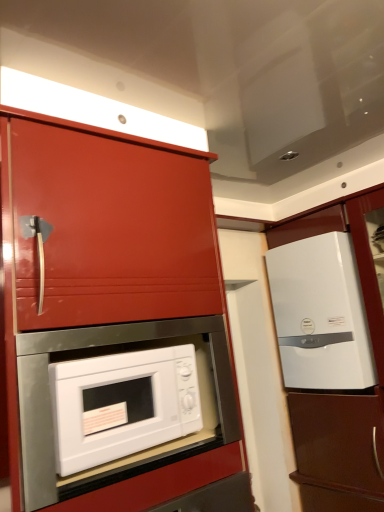
What do you see at coordinates (320, 314) in the screenshot?
I see `white glossy refrigerator at right` at bounding box center [320, 314].

What do you see at coordinates (115, 320) in the screenshot? I see `glossy red cabinet at center, the first cabinetry positioned from the left` at bounding box center [115, 320].

Where is `white glossy refrigerator at right`? The height and width of the screenshot is (512, 384). white glossy refrigerator at right is located at coordinates (320, 314).

Considering the relative sizes of white glossy refrigerator at right and white glossy cabinet at right, the 1th cabinetry from the back, in the image provided, is white glossy refrigerator at right smaller than white glossy cabinet at right, the 1th cabinetry from the back,?

Yes.

Is white glossy refrigerator at right positioned beyond the bounds of white glossy cabinet at right, the second cabinetry viewed from the left?

Actually, white glossy refrigerator at right is within white glossy cabinet at right, the second cabinetry viewed from the left.

Which of these two, white glossy refrigerator at right or white glossy cabinet at right, the 1th cabinetry from the back, stands shorter?

Standing shorter between the two is white glossy refrigerator at right.

Is glossy red cabinet at center, which is the second cabinetry from back to front, bigger or smaller than white glossy microwave at center?

Considering their sizes, glossy red cabinet at center, which is the second cabinetry from back to front, takes up more space than white glossy microwave at center.

From the image's perspective, which is above, glossy red cabinet at center, which is the second cabinetry from back to front, or white glossy microwave at center?

glossy red cabinet at center, which is the second cabinetry from back to front, from the image's perspective.

Is point (145, 152) closer to camera compared to point (167, 387)?

No, it is behind (167, 387).

Between white glossy cabinet at right, marked as the 1th cabinetry in a right-to-left arrangement, and glossy red cabinet at center, the 1th cabinetry when ordered from front to back, which one has smaller size?

With smaller size is white glossy cabinet at right, marked as the 1th cabinetry in a right-to-left arrangement.

From the image's perspective, between white glossy cabinet at right, marked as the 1th cabinetry in a right-to-left arrangement, and glossy red cabinet at center, which is the second cabinetry from back to front, which one is located above?

glossy red cabinet at center, which is the second cabinetry from back to front.

From the picture: Does white glossy cabinet at right, marked as the 1th cabinetry in a right-to-left arrangement, have a greater width compared to glossy red cabinet at center, arranged as the second cabinetry when viewed from the right?

Incorrect, the width of white glossy cabinet at right, marked as the 1th cabinetry in a right-to-left arrangement, does not surpass that of glossy red cabinet at center, arranged as the second cabinetry when viewed from the right.

Between white glossy cabinet at right, the second cabinetry viewed from the left, and glossy red cabinet at center, which is the second cabinetry from back to front, which one has more height?

white glossy cabinet at right, the second cabinetry viewed from the left, is taller.

Is point (107, 373) closer or farther from the camera than point (55, 456)?

Clearly, point (107, 373) is more distant from the camera than point (55, 456).

Based on their sizes in the image, would you say white glossy microwave at center is bigger or smaller than glossy red cabinet at center, the first cabinetry positioned from the left?

Clearly, white glossy microwave at center is smaller in size than glossy red cabinet at center, the first cabinetry positioned from the left.

In the image, there is a glossy red cabinet at center, the 1th cabinetry when ordered from front to back. Identify the location of microwave oven below it (from the image's perspective). This screenshot has width=384, height=512. (122, 404).

Does white glossy microwave at center have a greater height compared to glossy red cabinet at center, arranged as the second cabinetry when viewed from the right?

No, white glossy microwave at center is not taller than glossy red cabinet at center, arranged as the second cabinetry when viewed from the right.

From the image's perspective, which is below, white glossy microwave at center or white glossy cabinet at right, the 1th cabinetry from the back?

white glossy cabinet at right, the 1th cabinetry from the back, is shown below in the image.

Do you think white glossy microwave at center is within white glossy cabinet at right, the 1th cabinetry from the back, or outside of it?

white glossy microwave at center is spatially situated outside white glossy cabinet at right, the 1th cabinetry from the back.

Between white glossy microwave at center and white glossy cabinet at right, which is counted as the 2th cabinetry, starting from the front, which one has more height?

white glossy cabinet at right, which is counted as the 2th cabinetry, starting from the front, is taller.

Considering the sizes of white glossy refrigerator at right and glossy red cabinet at center, the 1th cabinetry when ordered from front to back, in the image, is white glossy refrigerator at right wider or thinner than glossy red cabinet at center, the 1th cabinetry when ordered from front to back,?

In the image, white glossy refrigerator at right appears to be more narrow than glossy red cabinet at center, the 1th cabinetry when ordered from front to back.

Is white glossy refrigerator at right not inside glossy red cabinet at center, which is the second cabinetry from back to front?

Yes, white glossy refrigerator at right is located beyond the bounds of glossy red cabinet at center, which is the second cabinetry from back to front.

Locate an element on the screen. Image resolution: width=384 pixels, height=512 pixels. the 2nd cabinetry in front of the white glossy refrigerator at right is located at coordinates (115, 320).

Is white glossy refrigerator at right oriented towards glossy red cabinet at center, the 1th cabinetry when ordered from front to back?

Yes.

Is glossy red cabinet at center, arranged as the second cabinetry when viewed from the right, oriented away from white glossy cabinet at right, the second cabinetry viewed from the left?

No, glossy red cabinet at center, arranged as the second cabinetry when viewed from the right, is not facing away from white glossy cabinet at right, the second cabinetry viewed from the left.

From the image's perspective, is glossy red cabinet at center, which is the second cabinetry from back to front, over white glossy cabinet at right, marked as the 1th cabinetry in a right-to-left arrangement?

Indeed, from the image's perspective, glossy red cabinet at center, which is the second cabinetry from back to front, is shown above white glossy cabinet at right, marked as the 1th cabinetry in a right-to-left arrangement.

Is glossy red cabinet at center, the 1th cabinetry when ordered from front to back, outside of white glossy cabinet at right, marked as the 1th cabinetry in a right-to-left arrangement?

Absolutely, glossy red cabinet at center, the 1th cabinetry when ordered from front to back, is external to white glossy cabinet at right, marked as the 1th cabinetry in a right-to-left arrangement.

Considering the relative sizes of glossy red cabinet at center, arranged as the second cabinetry when viewed from the right, and white glossy cabinet at right, the second cabinetry viewed from the left, in the image provided, is glossy red cabinet at center, arranged as the second cabinetry when viewed from the right, shorter than white glossy cabinet at right, the second cabinetry viewed from the left,?

Correct, glossy red cabinet at center, arranged as the second cabinetry when viewed from the right, is not as tall as white glossy cabinet at right, the second cabinetry viewed from the left.

The image size is (384, 512). In order to click on refrigerator above the white glossy cabinet at right, marked as the 1th cabinetry in a right-to-left arrangement (from the image's perspective) in this screenshot , I will do 320,314.

The image size is (384, 512). In order to click on cabinetry located in front of the white glossy microwave at center in this screenshot , I will do `click(115, 320)`.

Which object lies further to the anchor point white glossy refrigerator at right, glossy red cabinet at center, which is the second cabinetry from back to front, or white glossy cabinet at right, which is counted as the 2th cabinetry, starting from the front?

The object further to white glossy refrigerator at right is glossy red cabinet at center, which is the second cabinetry from back to front.

Estimate the real-world distances between objects in this image. Which object is further from white glossy cabinet at right, marked as the 1th cabinetry in a right-to-left arrangement, white glossy microwave at center or glossy red cabinet at center, which is the second cabinetry from back to front?

white glossy microwave at center is further to white glossy cabinet at right, marked as the 1th cabinetry in a right-to-left arrangement.

From the picture: When comparing their distances from white glossy refrigerator at right, does glossy red cabinet at center, the 1th cabinetry when ordered from front to back, or white glossy microwave at center seem further?

Among the two, white glossy microwave at center is located further to white glossy refrigerator at right.

In the scene shown: When comparing their distances from glossy red cabinet at center, which is the second cabinetry from back to front, does white glossy refrigerator at right or white glossy cabinet at right, marked as the 1th cabinetry in a right-to-left arrangement, seem closer?

white glossy refrigerator at right is closer to glossy red cabinet at center, which is the second cabinetry from back to front.

Based on the photo, estimate the real-world distances between objects in this image. Which object is further from white glossy refrigerator at right, white glossy microwave at center or white glossy cabinet at right, which is counted as the 2th cabinetry, starting from the front?

white glossy microwave at center is further to white glossy refrigerator at right.

Looking at the image, which one is located closer to white glossy refrigerator at right, white glossy cabinet at right, marked as the 1th cabinetry in a right-to-left arrangement, or glossy red cabinet at center, the 1th cabinetry when ordered from front to back?

white glossy cabinet at right, marked as the 1th cabinetry in a right-to-left arrangement, lies closer to white glossy refrigerator at right than the other object.

Estimate the real-world distances between objects in this image. Which object is closer to white glossy microwave at center, white glossy cabinet at right, the second cabinetry viewed from the left, or white glossy refrigerator at right?

Among the two, white glossy refrigerator at right is located nearer to white glossy microwave at center.

Which object lies nearer to the anchor point white glossy cabinet at right, which is counted as the 2th cabinetry, starting from the front, glossy red cabinet at center, arranged as the second cabinetry when viewed from the right, or white glossy microwave at center?

Among the two, glossy red cabinet at center, arranged as the second cabinetry when viewed from the right, is located nearer to white glossy cabinet at right, which is counted as the 2th cabinetry, starting from the front.

Where is `cabinetry positioned between glossy red cabinet at center, which is the second cabinetry from back to front, and white glossy refrigerator at right from near to far`? This screenshot has height=512, width=384. cabinetry positioned between glossy red cabinet at center, which is the second cabinetry from back to front, and white glossy refrigerator at right from near to far is located at coordinates (340, 391).

Locate an element on the screen. The image size is (384, 512). microwave oven between glossy red cabinet at center, which is the second cabinetry from back to front, and white glossy refrigerator at right in the front-back direction is located at coordinates (122, 404).

This screenshot has height=512, width=384. Find the location of `microwave oven located between glossy red cabinet at center, the first cabinetry positioned from the left, and white glossy cabinet at right, the second cabinetry viewed from the left, in the left-right direction`. microwave oven located between glossy red cabinet at center, the first cabinetry positioned from the left, and white glossy cabinet at right, the second cabinetry viewed from the left, in the left-right direction is located at coordinates click(122, 404).

You are a GUI agent. You are given a task and a screenshot of the screen. Output one action in this format:
    pyautogui.click(x=<x>, y=<y>)
    Task: Click on the refrigerator between white glossy microwave at center and white glossy cabinet at right, the second cabinetry viewed from the left
    The width and height of the screenshot is (384, 512).
    Given the screenshot: What is the action you would take?
    pyautogui.click(x=320, y=314)